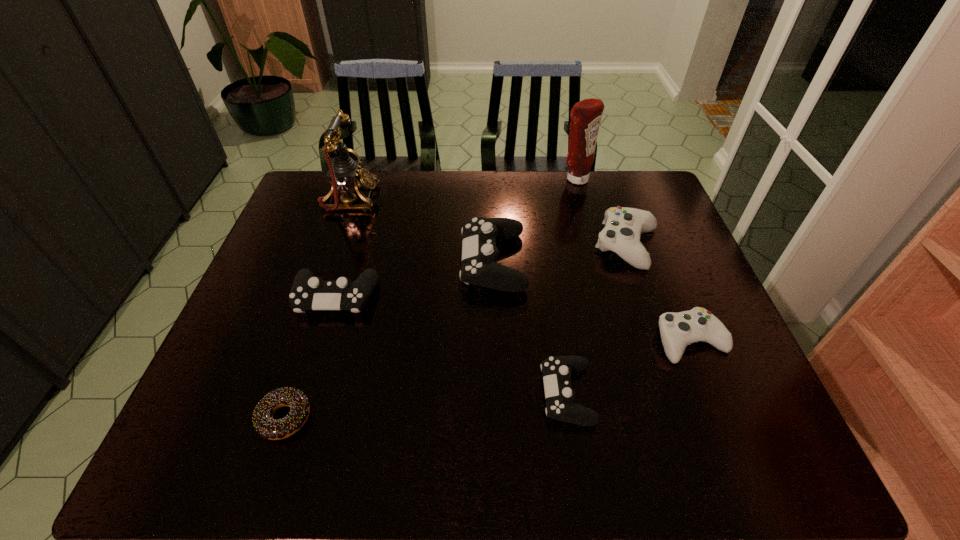
Find the location of a particular element. This screenshot has height=540, width=960. doughnut that is at the left edge is located at coordinates (264, 424).

Locate an element on the screen. This screenshot has height=540, width=960. object located in the far left corner section of the desktop is located at coordinates (345, 175).

In order to click on object located in the near left corner section of the desktop in this screenshot , I will do `click(264, 424)`.

I want to click on vacant region at the far edge, so (x=564, y=194).

At what (x,y) coordinates should I click in order to perform the action: click on free space at the near edge of the desktop. Please return your answer as a coordinate pair (x, y). Looking at the image, I should click on (632, 440).

Where is `vacant space at the left edge of the desktop`? vacant space at the left edge of the desktop is located at coordinates (265, 318).

This screenshot has width=960, height=540. In the image, there is a desktop. Identify the location of free space at the right edge. (686, 271).

The height and width of the screenshot is (540, 960). I want to click on free region at the far left corner of the desktop, so click(300, 206).

Image resolution: width=960 pixels, height=540 pixels. In order to click on vacant area between the leftmost black control and the biggest black control in this screenshot , I will do `click(414, 279)`.

At what (x,y) coordinates should I click in order to perform the action: click on free spot between the red condiment and the tallest control. Please return your answer as a coordinate pair (x, y). This screenshot has width=960, height=540. Looking at the image, I should click on (535, 220).